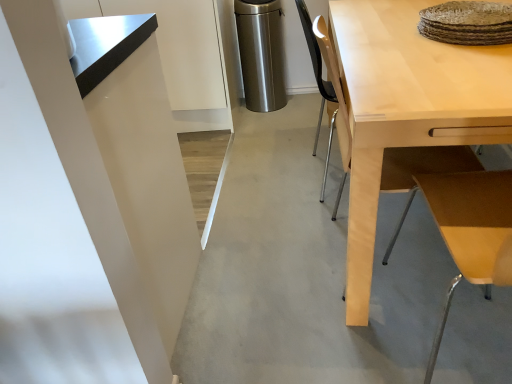
Question: From the image's perspective, is light wood desk at right above or below stainless steel trash can at center?

Choices:
 (A) below
 (B) above

Answer: (A)

Question: From a real-world perspective, is light wood desk at right positioned above or below stainless steel trash can at center?

Choices:
 (A) below
 (B) above

Answer: (B)

Question: Estimate the real-world distances between objects in this image. Which object is closer to the light wood table at upper right?

Choices:
 (A) stainless steel trash can at center
 (B) light wood desk at right

Answer: (B)

Question: Based on their relative distances, which object is farther from the light wood desk at right?

Choices:
 (A) stainless steel trash can at center
 (B) light wood table at upper right

Answer: (A)